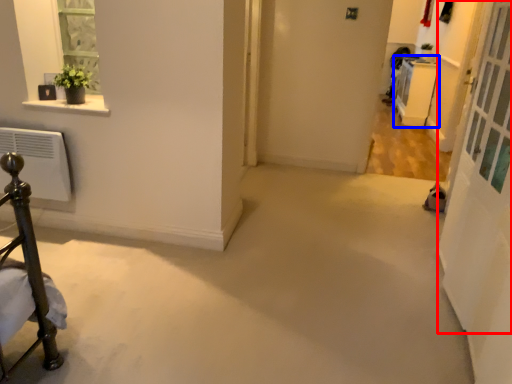
Question: Which object is closer to the camera taking this photo, screen door (highlighted by a red box) or furniture (highlighted by a blue box)?

Choices:
 (A) screen door
 (B) furniture

Answer: (A)